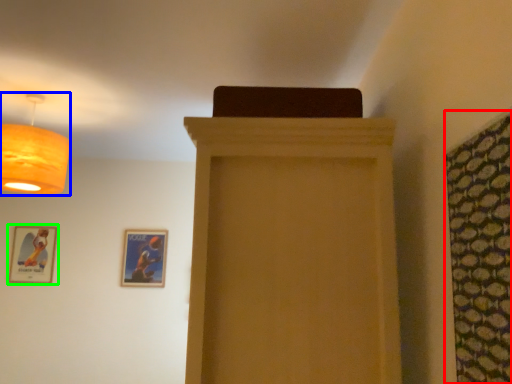
Question: Estimate the real-world distances between objects in this image. Which object is farther from curtain (highlighted by a red box), lamp (highlighted by a blue box) or picture frame (highlighted by a green box)?

Choices:
 (A) lamp
 (B) picture frame

Answer: (B)